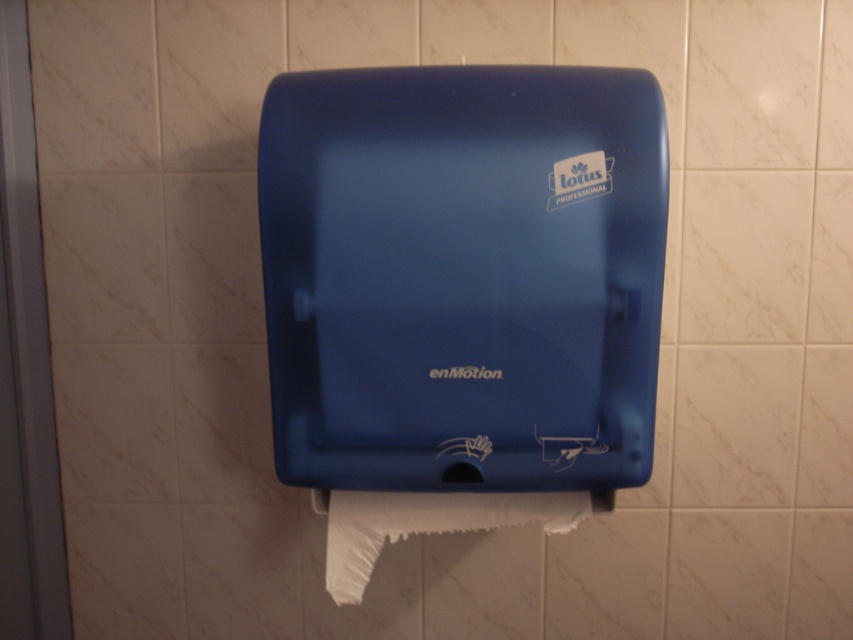
Measure the distance from matte blue dispenser at center to white matte toilet paper at lower center.

matte blue dispenser at center is 7.02 inches away from white matte toilet paper at lower center.

Between matte blue dispenser at center and white matte toilet paper at lower center, which one appears on the left side from the viewer's perspective?

Positioned to the left is white matte toilet paper at lower center.

Between point (592, 384) and point (393, 529), which one is positioned behind?

The point (393, 529) is behind.

Find the location of `matte blue dispenser at center`. matte blue dispenser at center is located at coordinates (463, 276).